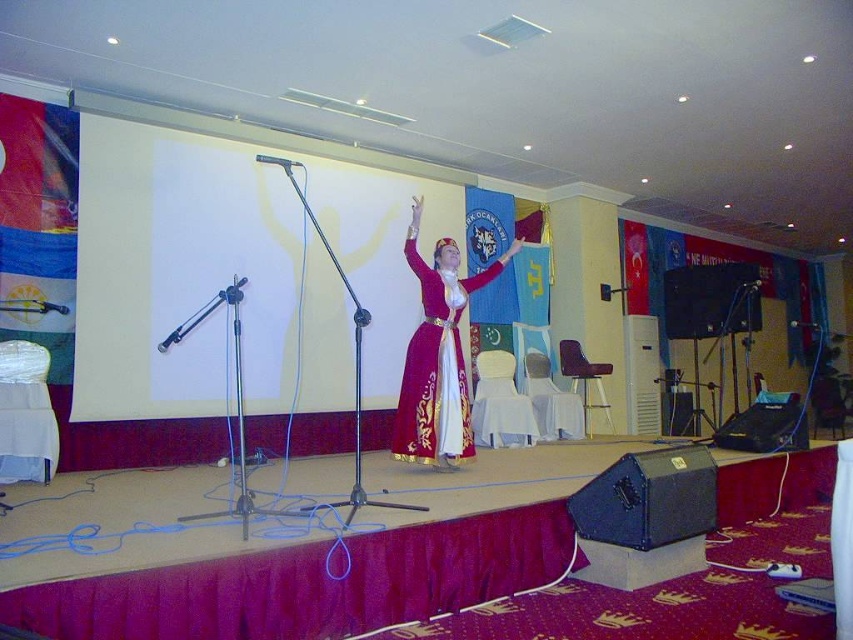
Question: Which is farther from the metallic silver microphone at left?

Choices:
 (A) black matte microphone at center
 (B) black metallic microphone at center
 (C) metallic silver microphone at upper center
 (D) velvet maroon dress at center

Answer: (B)

Question: Which object is farther from the camera taking this photo?

Choices:
 (A) metallic silver microphone at upper center
 (B) black matte microphone at center

Answer: (B)

Question: Is metallic silver microphone at left behind black metallic microphone at center?

Choices:
 (A) yes
 (B) no

Answer: (B)

Question: Can you confirm if metallic silver microphone at upper center is positioned above metallic silver microphone at left?

Choices:
 (A) yes
 (B) no

Answer: (A)

Question: Among these points, which one is farthest from the camera?

Choices:
 (A) (759, 282)
 (B) (459, 387)

Answer: (A)

Question: Does black metallic microphone at center appear under black matte microphone at center?

Choices:
 (A) yes
 (B) no

Answer: (A)